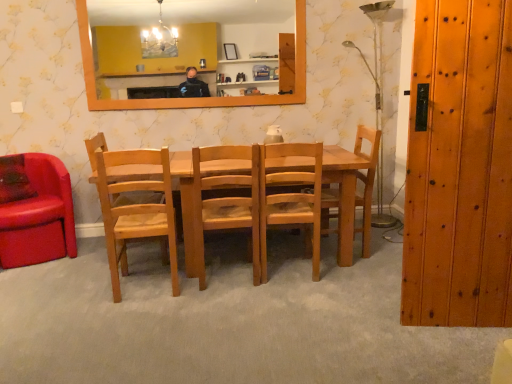
Identify the location of vacant space in light brown wood chair at center, which appears as the second chair when viewed from the right (from a real-world perspective). (288, 266).